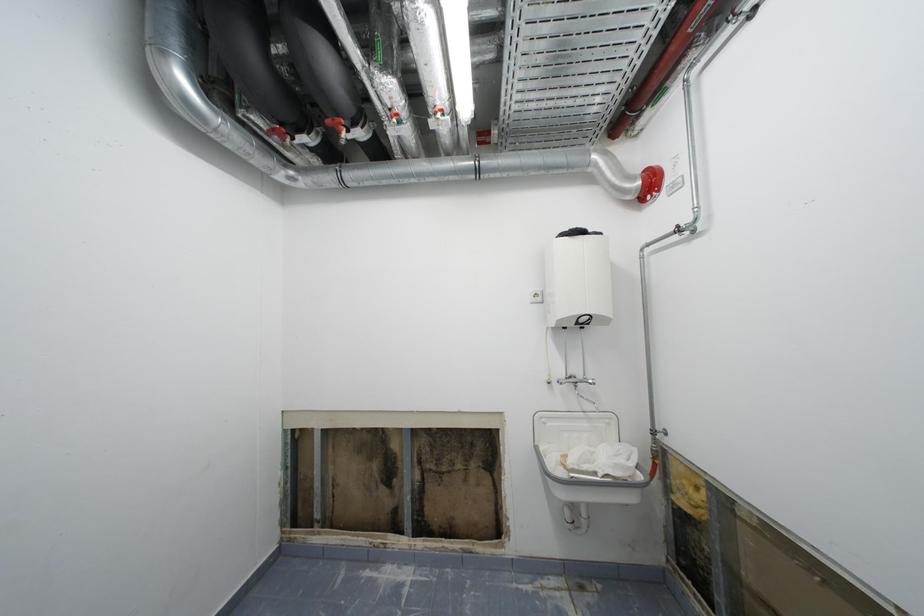
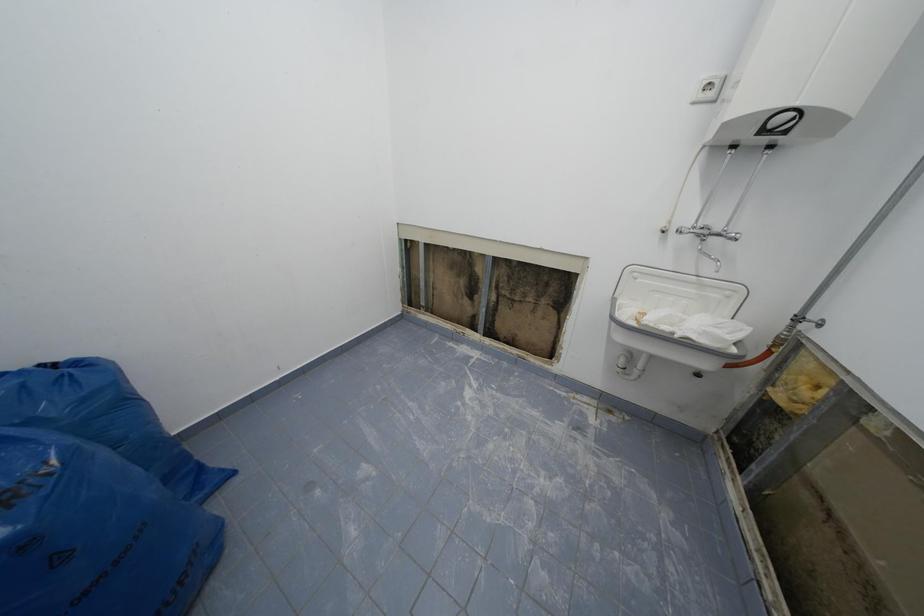
The images are taken continuously from a first-person perspective. In which direction is your viewpoint rotating?

The camera rotated toward left-down.